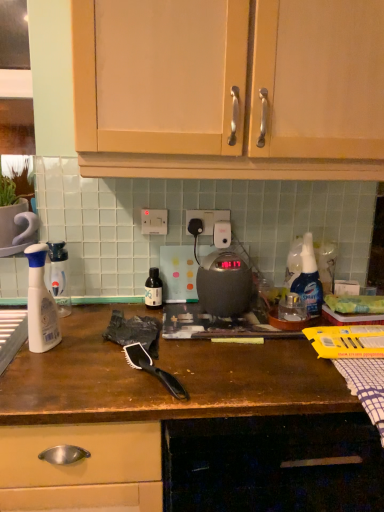
Question: Is point (147, 223) closer or farther from the camera than point (231, 311)?

Choices:
 (A) farther
 (B) closer

Answer: (A)

Question: From the image's perspective, is white plastic electric outlet at center, which is the 1th electric outlet from left to right, above or below matte black kettle at center?

Choices:
 (A) above
 (B) below

Answer: (A)

Question: Which of these objects is positioned closest to the translucent plastic spray bottle at left?

Choices:
 (A) translucent plastic spray bottle at right
 (B) matte wood cabinets at upper center, which is the 1th cabinetry in top-to-bottom order
 (C) white plastic electric outlet at center, the 2th electric outlet viewed from the right
 (D) white plastic electric outlet at center, arranged as the 2th electric outlet when viewed from the left
 (E) white plastic spray bottle at left, which is the second bottle in right-to-left order

Answer: (E)

Question: Estimate the real-world distances between objects in this image. Which object is closer to the translucent plastic spray bottle at right?

Choices:
 (A) matte black kettle at center
 (B) white plastic electric outlet at center, the first electric outlet when ordered from right to left
 (C) translucent plastic spray bottle at left
 (D) matte black bottle at center, which ranks as the 1th bottle in right-to-left order
 (E) white plastic electric outlet at center, the 2th electric outlet viewed from the right

Answer: (A)